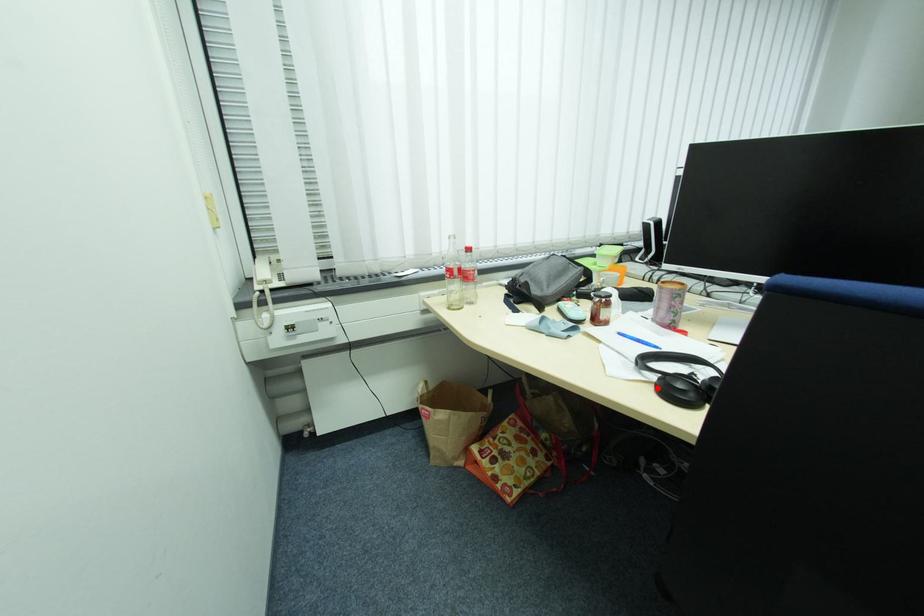
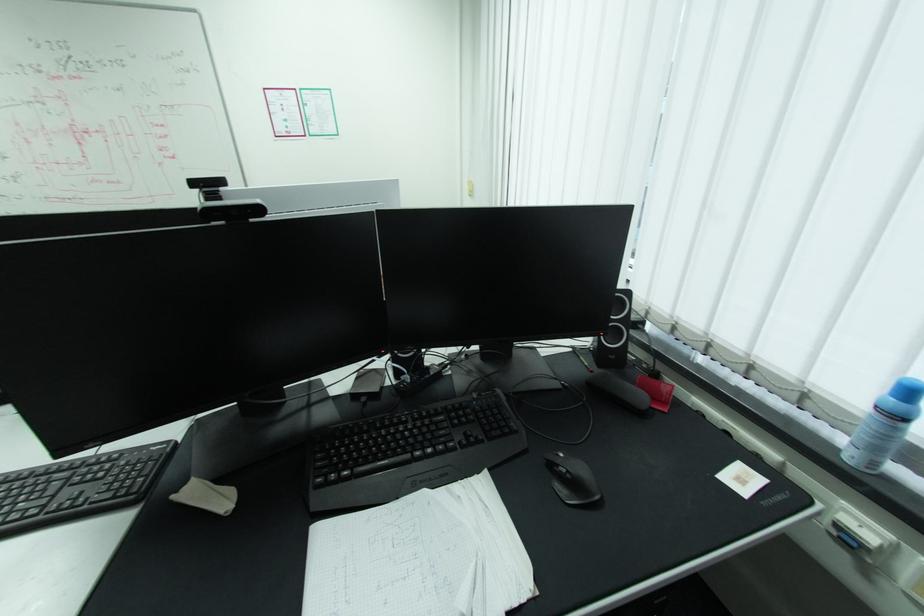
Question: I am providing you with two images of the same scene from different viewpoints. A red point is marked on the first image. Can you still see the location of the red point in image 2?

Choices:
 (A) Yes
 (B) No

Answer: (B)